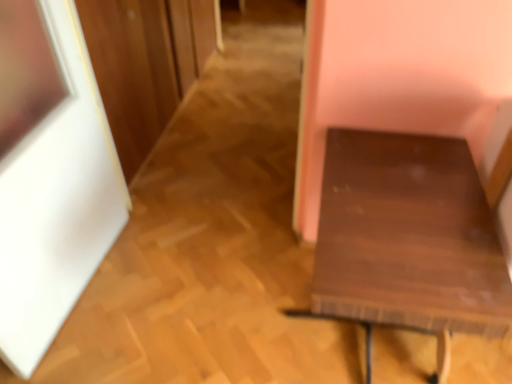
I want to click on vacant space underneath white matte picture frame at left (from a real-world perspective), so click(87, 295).